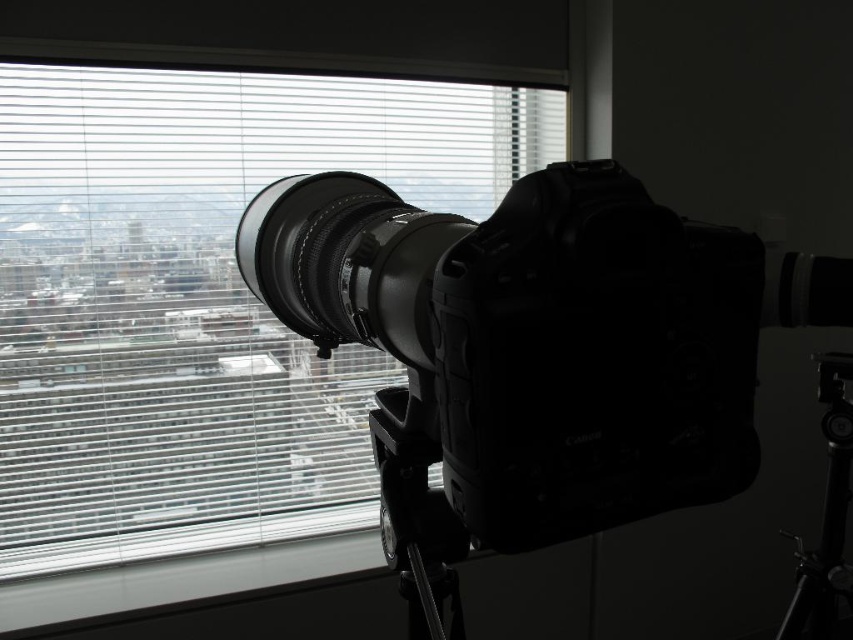
You are setting up a photography studio and need to place the black matte camera at center and the black metal tripod at lower right on a shelf. The shelf has a width of 1.2 meters. Can both items fit side by side on the shelf without overlapping?

The black matte camera at center might be wider than black metal tripod at lower right. Since the shelf is 1.2 meters wide, it depends on their combined widths. However, the description only states that the camera might be wider, not the exact dimensions. Without specific measurements, we cannot confirm if they will fit.

You are setting up a camera for a photoshoot and notice the white matte blinds at upper center and the black metal tripod at lower right. Which object is positioned higher in the image?

The white matte blinds at upper center is located above the black metal tripod at lower right, so it is positioned higher in the image.

You are a photographer setting up your equipment. You have a white matte blinds at upper center and a black matte camera at center. Which object is taller in the scene?

The white matte blinds at upper center is taller than the black matte camera at center.